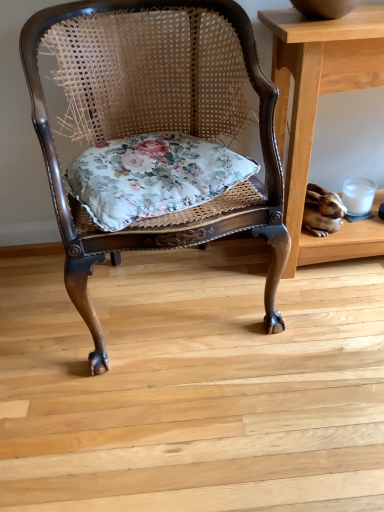
Where is `free space between rattan chair with floral cushion at center and light brown wooden table at right`? free space between rattan chair with floral cushion at center and light brown wooden table at right is located at coordinates (312, 294).